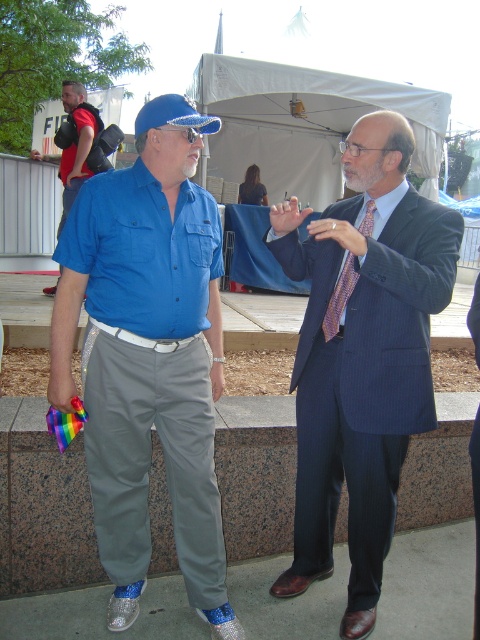
How distant is shiny metallic shoes at lower center from blue pinstripe suit at center?

18.55 inches

Is shiny metallic shoes at lower center taller than blue pinstripe suit at center?

No, shiny metallic shoes at lower center is not taller than blue pinstripe suit at center.

The height and width of the screenshot is (640, 480). Find the location of `shiny metallic shoes at lower center`. shiny metallic shoes at lower center is located at coordinates (147, 365).

Is shiny metallic shoes at lower center in front of white fabric canopy at upper center?

Yes, it is in front of white fabric canopy at upper center.

Locate an element on the screen. shiny metallic shoes at lower center is located at coordinates (147, 365).

What do you see at coordinates (76, 145) in the screenshot? The width and height of the screenshot is (480, 640). I see `matte black backpack at upper left` at bounding box center [76, 145].

Can you confirm if matte black backpack at upper left is smaller than purple striped tie at center?

Incorrect, matte black backpack at upper left is not smaller in size than purple striped tie at center.

Is point (66, 148) behind point (355, 269)?

Yes, point (66, 148) is behind point (355, 269).

Find the location of a particular element. The height and width of the screenshot is (640, 480). matte black backpack at upper left is located at coordinates (76, 145).